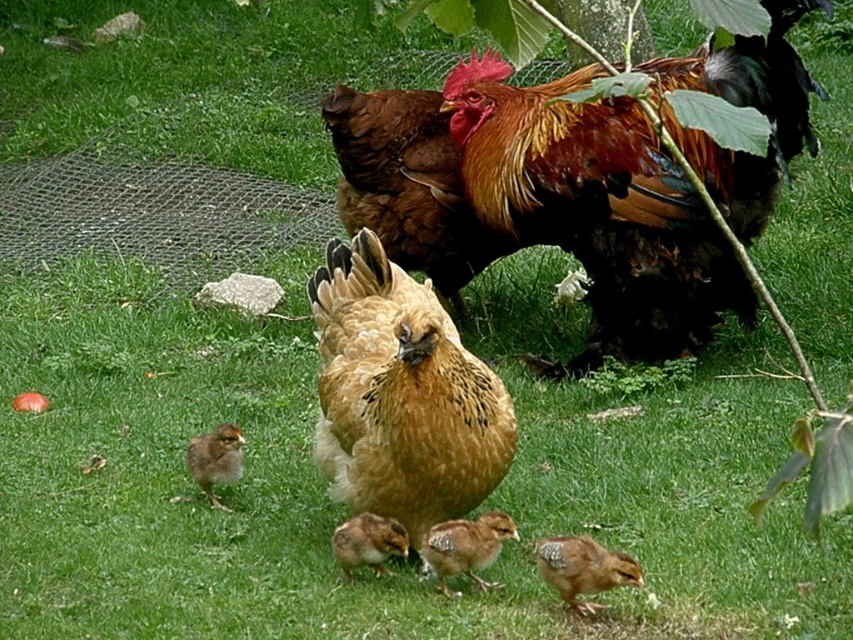
Question: Does golden feathered rooster at upper right appear under brown speckled chick at center?

Choices:
 (A) yes
 (B) no

Answer: (B)

Question: Is speckled feathered chick at lower center below brown speckled chick at center?

Choices:
 (A) no
 (B) yes

Answer: (B)

Question: Which object appears farthest from the camera in this image?

Choices:
 (A) brown speckled chick at center
 (B) brown speckled chick at lower left
 (C) speckled feathered chick at lower center

Answer: (B)

Question: Among these points, which one is nearest to the camera?

Choices:
 (A) (390, 529)
 (B) (227, 436)
 (C) (627, 582)
 (D) (637, 141)

Answer: (C)

Question: Which point is closer to the camera?

Choices:
 (A) (463, 173)
 (B) (457, 570)
 (C) (570, 554)
 (D) (219, 481)

Answer: (C)

Question: Can you confirm if golden feathered rooster at upper right is wider than speckled feathered chick at lower center?

Choices:
 (A) yes
 (B) no

Answer: (A)